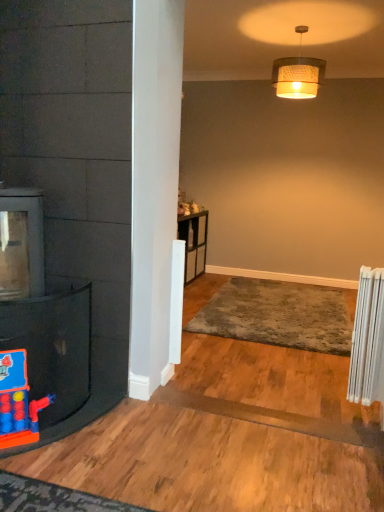
Question: Is white plastic radiator at right at the right side of rubberized plastic toy at left?

Choices:
 (A) yes
 (B) no

Answer: (A)

Question: Can you confirm if white plastic radiator at right is taller than rubberized plastic toy at left?

Choices:
 (A) no
 (B) yes

Answer: (B)

Question: Is rubberized plastic toy at left completely or partially inside white plastic radiator at right?

Choices:
 (A) no
 (B) yes

Answer: (A)

Question: Is rubberized plastic toy at left at the back of white plastic radiator at right?

Choices:
 (A) no
 (B) yes

Answer: (A)

Question: Is white plastic radiator at right bigger than rubberized plastic toy at left?

Choices:
 (A) yes
 (B) no

Answer: (A)

Question: Would you say white plastic radiator at right is a long distance from rubberized plastic toy at left?

Choices:
 (A) no
 (B) yes

Answer: (B)

Question: Can you confirm if rubberized plastic toy at left is positioned to the left of woven fabric lampshade at upper center?

Choices:
 (A) no
 (B) yes

Answer: (B)

Question: From the image's perspective, is rubberized plastic toy at left under woven fabric lampshade at upper center?

Choices:
 (A) no
 (B) yes

Answer: (B)

Question: Does rubberized plastic toy at left have a lesser width compared to woven fabric lampshade at upper center?

Choices:
 (A) yes
 (B) no

Answer: (A)

Question: Can you confirm if rubberized plastic toy at left is smaller than woven fabric lampshade at upper center?

Choices:
 (A) no
 (B) yes

Answer: (B)

Question: From the image's perspective, is rubberized plastic toy at left over woven fabric lampshade at upper center?

Choices:
 (A) yes
 (B) no

Answer: (B)

Question: Are rubberized plastic toy at left and woven fabric lampshade at upper center located far from each other?

Choices:
 (A) yes
 (B) no

Answer: (A)

Question: Is gray plush rug at center smaller than woven fabric lampshade at upper center?

Choices:
 (A) no
 (B) yes

Answer: (A)